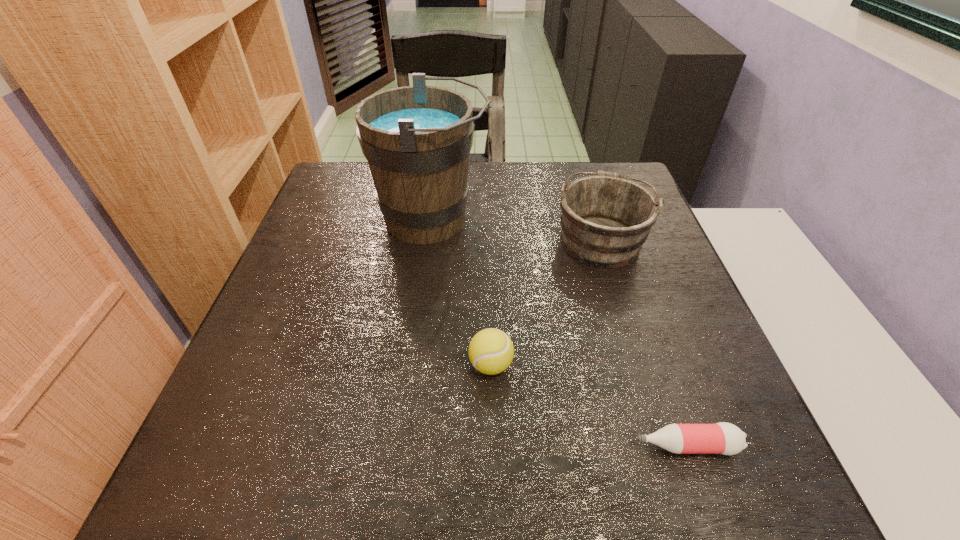
Find the location of `vacant area between the second shortest object and the tallest object`. vacant area between the second shortest object and the tallest object is located at coordinates (462, 292).

Where is `free space that is in between the third shortest object and the tallest object`? free space that is in between the third shortest object and the tallest object is located at coordinates tap(516, 230).

Where is `free space between the tallest object and the shortest object`? This screenshot has width=960, height=540. free space between the tallest object and the shortest object is located at coordinates (559, 333).

This screenshot has width=960, height=540. Identify the location of vacant region between the tallest object and the second nearest object. (462, 292).

Choose which object is the second nearest neighbor to the tennis ball. Please provide its 2D coordinates. Your answer should be formatted as a tuple, i.e. [(x, y)], where the tuple contains the x and y coordinates of a point satisfying the conditions above.

[(605, 219)]

Locate which object is the third closest to the bottle. Please provide its 2D coordinates. Your answer should be formatted as a tuple, i.e. [(x, y)], where the tuple contains the x and y coordinates of a point satisfying the conditions above.

[(417, 139)]

This screenshot has height=540, width=960. What are the coordinates of `blank space that satisfies the following two spatial constraints: 1. with a handle on the side of the second shortest object; 2. on the right side of the tallest object` in the screenshot? It's located at (413, 365).

Where is `free spot that satisfies the following two spatial constraints: 1. with a handle on the side of the right wine bucket; 2. on the right side of the left wine bucket`? This screenshot has width=960, height=540. free spot that satisfies the following two spatial constraints: 1. with a handle on the side of the right wine bucket; 2. on the right side of the left wine bucket is located at coordinates (429, 239).

The image size is (960, 540). What are the coordinates of `vacant region that satisfies the following two spatial constraints: 1. with a handle on the side of the left wine bucket; 2. on the back side of the second shortest object` in the screenshot? It's located at (413, 365).

The height and width of the screenshot is (540, 960). I want to click on free space that satisfies the following two spatial constraints: 1. on the back side of the right wine bucket; 2. with a handle on the side of the tallest object, so click(594, 219).